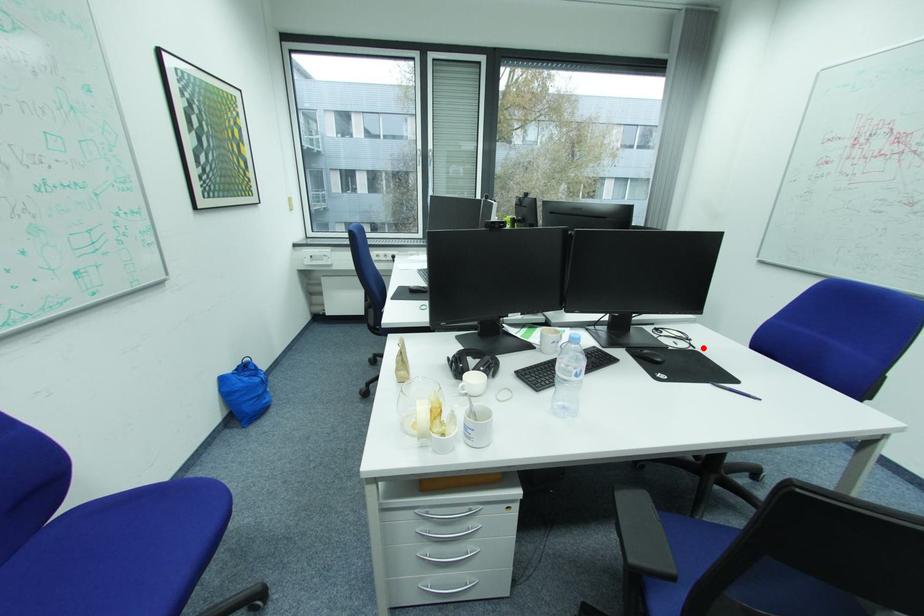
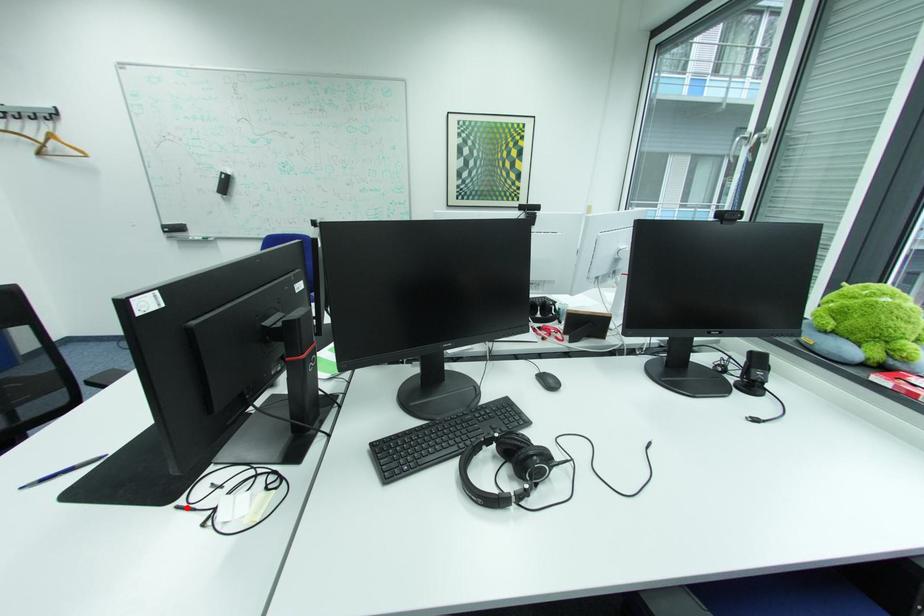
I am providing you with two images of the same scene from different viewpoints. A red point is marked on the first image and another point is marked on the second image. Does the point marked in image1 correspond to the same location as the one in image2?

Yes